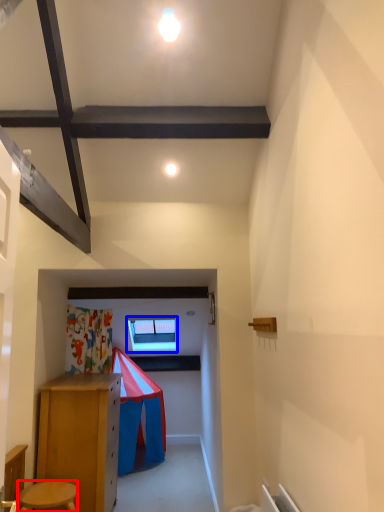
Question: Which of the following is the closest to the observer, stool (highlighted by a red box) or window (highlighted by a blue box)?

Choices:
 (A) stool
 (B) window

Answer: (A)